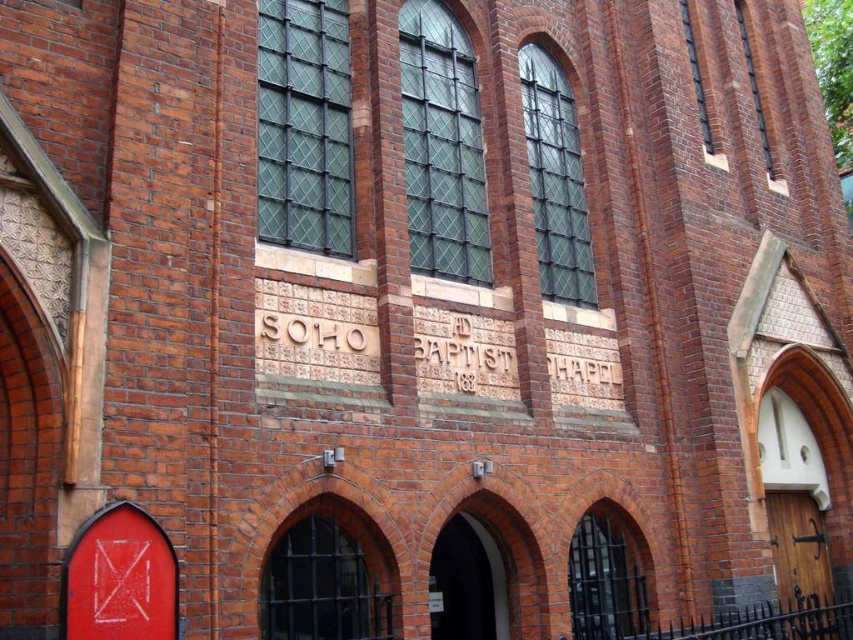
Based on the photo, you are a visitor arriving at Soho Baptist Chapel and need to enter through one of the doors. The smooth red door at lower left and the wooden door at right are both visible. Which door is higher up on the building?

The smooth red door at lower left is positioned over the wooden door at right, meaning it is higher up on the building.

You are a delivery person trying to enter the Soho Baptist Chapel. You notice two doors on the building. The smooth red door at lower left and the wooden door at right. Which door is wider?

The wooden door at right is wider than the smooth red door at lower left.